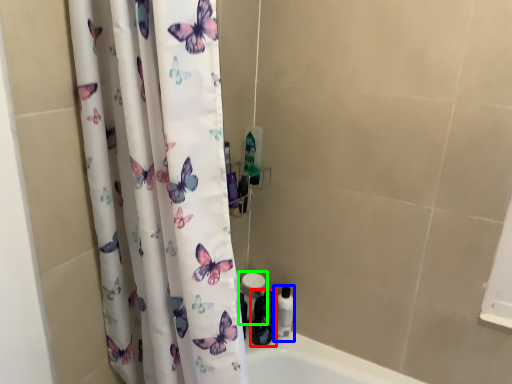
Question: Which object is positioned farthest from toiletry (highlighted by a red box)? Select from toiletry (highlighted by a blue box) and toilet paper (highlighted by a green box).

Choices:
 (A) toiletry
 (B) toilet paper

Answer: (B)